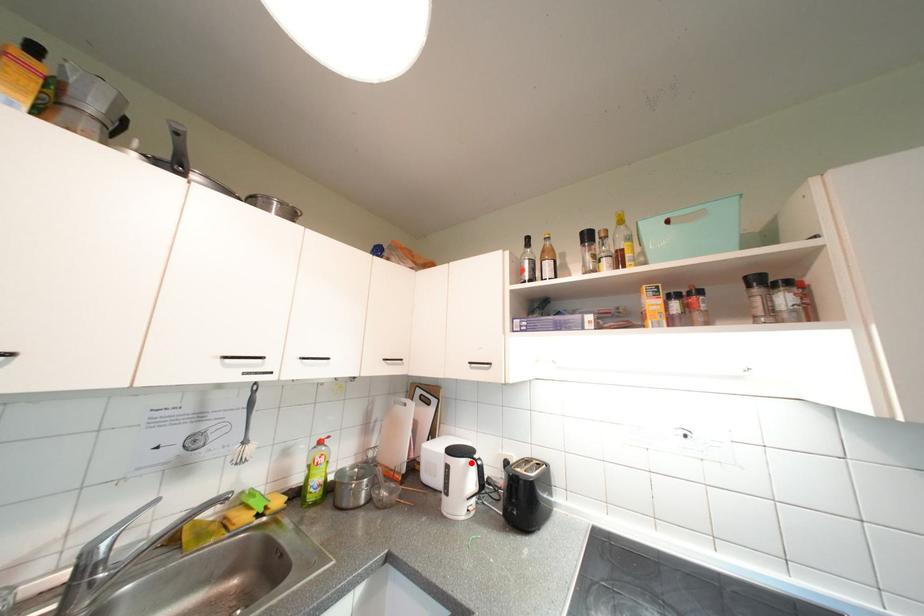
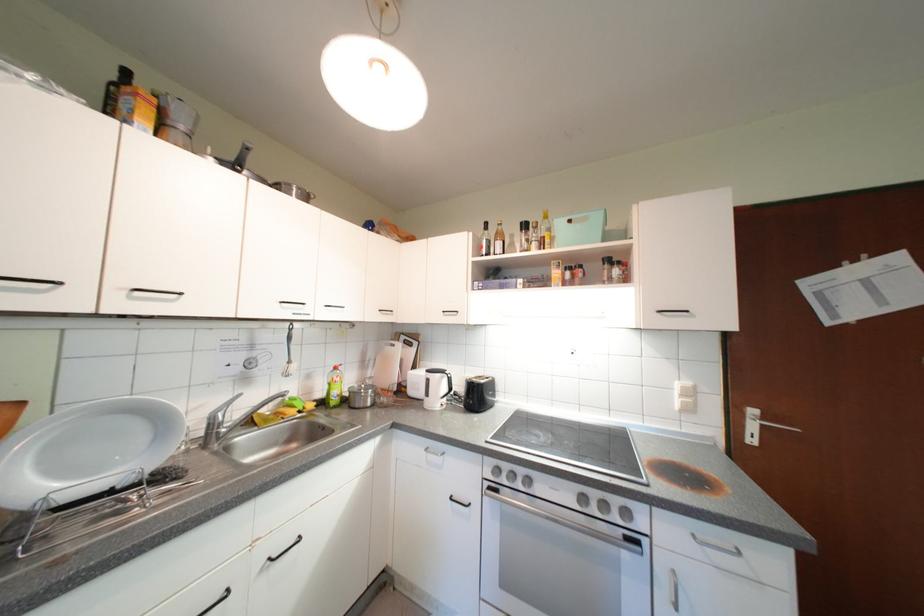
Question: I am providing you with two images of the same scene from different viewpoints. A red point is marked on the first image. Is the red point's position out of view in image 2?

Choices:
 (A) Yes
 (B) No

Answer: (B)